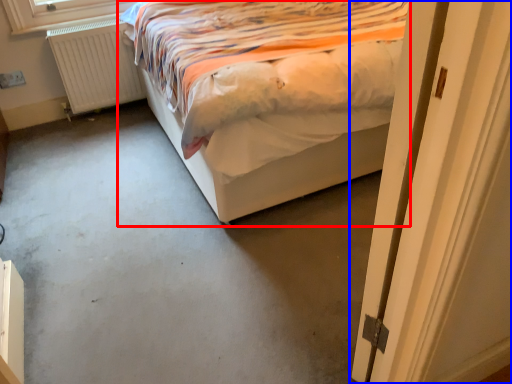
Question: Which point is further to the camera, bed (highlighted by a red box) or door (highlighted by a blue box)?

Choices:
 (A) bed
 (B) door

Answer: (A)